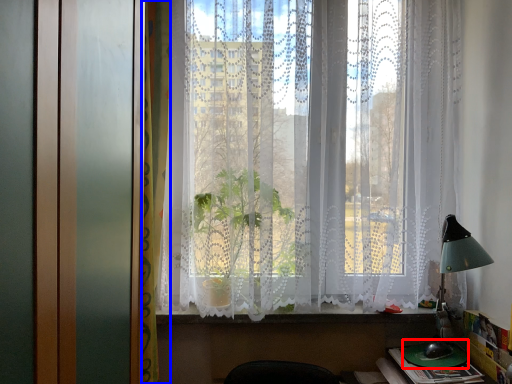
Question: Among these objects, which one is nearest to the camera, round table (highlighted by a red box) or curtain (highlighted by a blue box)?

Choices:
 (A) round table
 (B) curtain

Answer: (B)